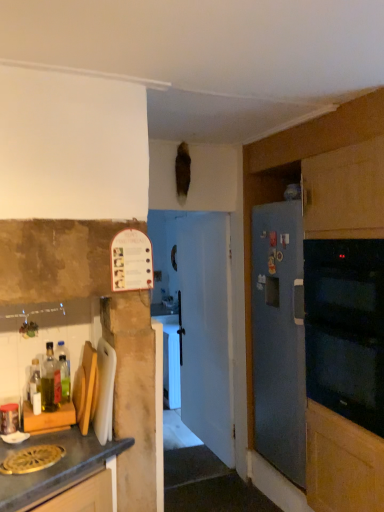
Question: Is translucent plastic bottle at left, which is the first bottle from back to front, far away from white glossy door at center?

Choices:
 (A) yes
 (B) no

Answer: (A)

Question: From a real-world perspective, is translucent plastic bottle at left, which is the 2th bottle in front-to-back order, on top of white glossy door at center?

Choices:
 (A) no
 (B) yes

Answer: (B)

Question: Is translucent plastic bottle at left, which is the 2th bottle in front-to-back order, turned away from white glossy door at center?

Choices:
 (A) yes
 (B) no

Answer: (B)

Question: Is white glossy door at center located within translucent plastic bottle at left, which is the 2th bottle in front-to-back order?

Choices:
 (A) yes
 (B) no

Answer: (B)

Question: Does translucent plastic bottle at left, which is the first bottle from back to front, have a greater height compared to white glossy door at center?

Choices:
 (A) no
 (B) yes

Answer: (A)

Question: From the image's perspective, is translucent plastic bottle at left, which is the 2th bottle in front-to-back order, below white glossy door at center?

Choices:
 (A) no
 (B) yes

Answer: (A)

Question: Is matte wood cutting board at lower left, positioned as the second cabinetry in back-to-front order, behind blue matte refrigerator at right, acting as the 2th cabinetry starting from the front?

Choices:
 (A) yes
 (B) no

Answer: (B)

Question: Is matte wood cutting board at lower left, positioned as the second cabinetry in back-to-front order, to the left of blue matte refrigerator at right, which is counted as the second cabinetry, starting from the left, from the viewer's perspective?

Choices:
 (A) yes
 (B) no

Answer: (A)

Question: Is matte wood cutting board at lower left, marked as the first cabinetry in a left-to-right arrangement, thinner than blue matte refrigerator at right, acting as the 2th cabinetry starting from the front?

Choices:
 (A) yes
 (B) no

Answer: (B)

Question: From the image's perspective, is matte wood cutting board at lower left, placed as the first cabinetry when sorted from front to back, located above blue matte refrigerator at right, the 1th cabinetry from the back?

Choices:
 (A) yes
 (B) no

Answer: (B)

Question: Does matte wood cutting board at lower left, positioned as the second cabinetry in back-to-front order, have a larger size compared to blue matte refrigerator at right, acting as the 2th cabinetry starting from the front?

Choices:
 (A) yes
 (B) no

Answer: (B)

Question: From a real-world perspective, is matte wood cutting board at lower left, placed as the first cabinetry when sorted from front to back, located higher than blue matte refrigerator at right, which is counted as the second cabinetry, starting from the left?

Choices:
 (A) yes
 (B) no

Answer: (B)

Question: Considering the relative sizes of white plastic cutting board at left and matte wood cutting board at lower left, placed as the first cabinetry when sorted from front to back, in the image provided, is white plastic cutting board at left bigger than matte wood cutting board at lower left, placed as the first cabinetry when sorted from front to back,?

Choices:
 (A) no
 (B) yes

Answer: (A)